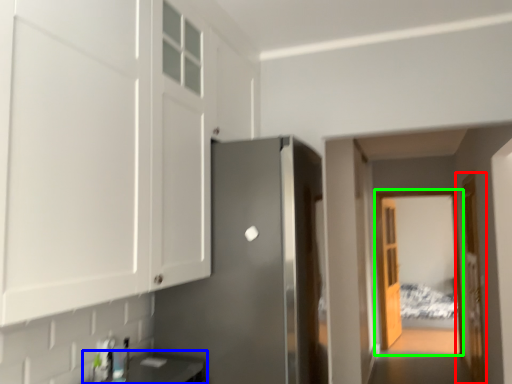
Question: Based on their relative distances, which object is nearer to door (highlighted by a red box)? Choose from counter top (highlighted by a blue box) and glass door (highlighted by a green box).

Choices:
 (A) counter top
 (B) glass door

Answer: (B)